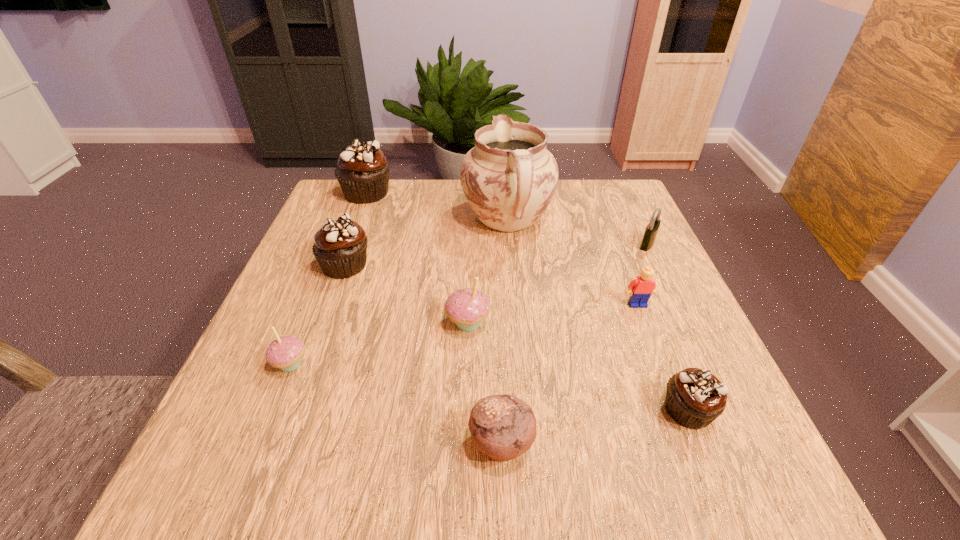
Locate an element on the screen. The height and width of the screenshot is (540, 960). pitcher is located at coordinates (509, 178).

Where is `the tallest object`? The image size is (960, 540). the tallest object is located at coordinates (509, 178).

Identify the location of the tallest cupcake. (363, 170).

The width and height of the screenshot is (960, 540). Identify the location of the farthest brown cupcake. (363, 170).

This screenshot has width=960, height=540. I want to click on the second biggest brown cupcake, so click(x=340, y=247).

Where is `the second nearest brown cupcake`? The image size is (960, 540). the second nearest brown cupcake is located at coordinates (340, 247).

At what (x,y) coordinates should I click in order to perform the action: click on the bigger pink cupcake. Please return your answer as a coordinate pair (x, y). This screenshot has width=960, height=540. Looking at the image, I should click on (467, 307).

Image resolution: width=960 pixels, height=540 pixels. I want to click on the right pink cupcake, so click(467, 307).

Locate an element on the screen. black padlock is located at coordinates (651, 230).

Image resolution: width=960 pixels, height=540 pixels. In order to click on Lego in this screenshot , I will do `click(642, 287)`.